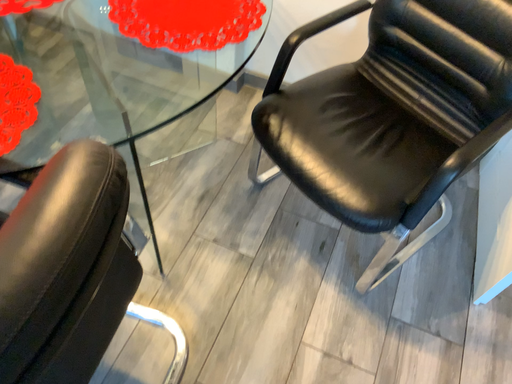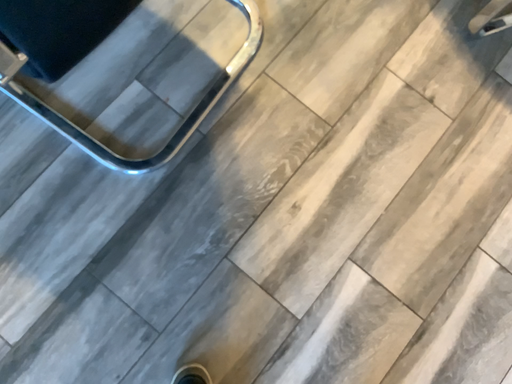
Question: Which way did the camera rotate in the video?

Choices:
 (A) rotated right
 (B) rotated left

Answer: (B)